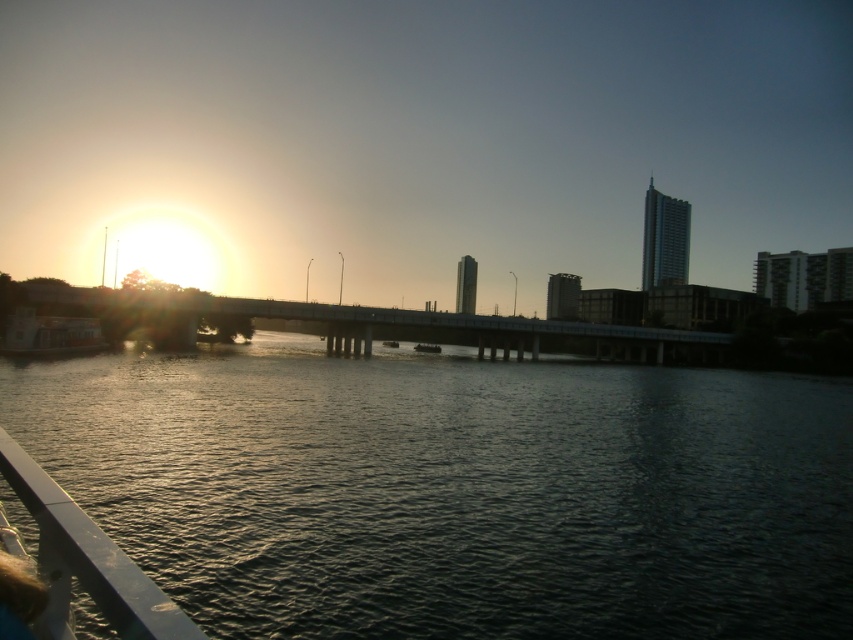
You are a photographer standing on the metallic gray boat at center, aiming to capture the reflection of the sunset on the dark water at center. Which direction should you move to ensure the boat doesn not block the view of the water?

Since the dark water at center is positioned on the right side of the metallic gray boat at center, you should move the metallic gray boat at center to the left to avoid blocking the view of the dark water at center.

You are a photographer standing at the riverside and want to position your camera so that the metallic silver rail at lower left is exactly at the center of your viewfinder. Given that the viewfinder has a 16x9 aspect ratio, what adjustment should you make to your camera position or framing to achieve this?

To center the metallic silver rail at lower left in the viewfinder, you need to move the camera upwards and to the right since the rail is currently located at point (86, 561), which is closer to the lower left corner. Adjusting the framing to shift the viewfinder upwards and to the right will bring the rail into the center.